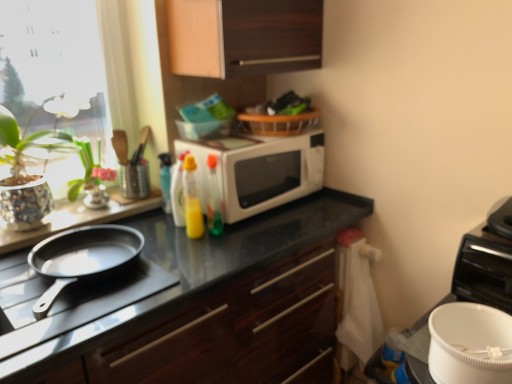
The height and width of the screenshot is (384, 512). What are the coordinates of `white glossy microwave at center` in the screenshot? It's located at (259, 170).

In order to face white glossy microwave at center, should I rotate leftwards or rightwards?

Rotate your view right by about 0.259°.

Measure the distance between point (509, 297) and camera.

The distance of point (509, 297) from camera is 1.20 meters.

You are a GUI agent. You are given a task and a screenshot of the screen. Output one action in this format:
    pyautogui.click(x=<x>, y=<y>)
    Task: Click on the translucent plastic spray bottle at upper center, marked as the fourth bottle in a right-to-left arrangement
    Image resolution: width=512 pixels, height=384 pixels.
    Given the screenshot: What is the action you would take?
    pyautogui.click(x=165, y=180)

At what (x,y) coordinates should I click in order to perform the action: click on translucent plastic bottle at center, which is counted as the 4th bottle, starting from the left. Please return your answer as a coordinate pair (x, y). This screenshot has height=384, width=512. Looking at the image, I should click on pyautogui.click(x=213, y=198).

Does white plastic bucket at lower right have a greater width compared to translucent plastic bottle at center, which is counted as the 4th bottle, starting from the left?

Yes.

Which of these two, white plastic bucket at lower right or translucent plastic bottle at center, which is counted as the 4th bottle, starting from the left, stands taller?

white plastic bucket at lower right is taller.

Is white plastic bucket at lower right smaller than translucent plastic bottle at center, which ranks as the 1th bottle in right-to-left order?

Actually, white plastic bucket at lower right might be larger than translucent plastic bottle at center, which ranks as the 1th bottle in right-to-left order.

Can you see white plastic bucket at lower right touching translucent plastic bottle at center, which is counted as the 4th bottle, starting from the left?

white plastic bucket at lower right and translucent plastic bottle at center, which is counted as the 4th bottle, starting from the left, are clearly separated.

Considering the relative sizes of white plastic bucket at lower right and glossy dark wood cabinet at center, acting as the 2th cabinetry starting from the top, in the image provided, is white plastic bucket at lower right shorter than glossy dark wood cabinet at center, acting as the 2th cabinetry starting from the top,?

Indeed, white plastic bucket at lower right has a lesser height compared to glossy dark wood cabinet at center, acting as the 2th cabinetry starting from the top.

Is white plastic bucket at lower right with glossy dark wood cabinet at center, acting as the 2th cabinetry starting from the top?

There is a gap between white plastic bucket at lower right and glossy dark wood cabinet at center, acting as the 2th cabinetry starting from the top.

Which object is positioned more to the left, white plastic bucket at lower right or glossy dark wood cabinet at center, acting as the 2th cabinetry starting from the top?

Positioned to the left is glossy dark wood cabinet at center, acting as the 2th cabinetry starting from the top.

Could you tell me if translucent plastic bottle at center, marked as the 3th bottle in a left-to-right arrangement, is turned towards white matte mixing bowl at lower right?

No, translucent plastic bottle at center, marked as the 3th bottle in a left-to-right arrangement, is not oriented towards white matte mixing bowl at lower right.

Between translucent plastic bottle at center, marked as the 3th bottle in a left-to-right arrangement, and white matte mixing bowl at lower right, which one appears on the left side from the viewer's perspective?

From the viewer's perspective, translucent plastic bottle at center, marked as the 3th bottle in a left-to-right arrangement, appears more on the left side.

Consider the image. Relative to white matte mixing bowl at lower right, is translucent plastic bottle at center, marked as the 3th bottle in a left-to-right arrangement, in front or behind?

translucent plastic bottle at center, marked as the 3th bottle in a left-to-right arrangement, is positioned farther from the viewer than white matte mixing bowl at lower right.

Is point (199, 204) closer to viewer compared to point (163, 191)?

Yes, it is.

Is translucent plastic bottle at center, marked as the 3th bottle in a left-to-right arrangement, wider than translucent plastic spray bottle at upper center, marked as the fourth bottle in a right-to-left arrangement?

Yes, translucent plastic bottle at center, marked as the 3th bottle in a left-to-right arrangement, is wider than translucent plastic spray bottle at upper center, marked as the fourth bottle in a right-to-left arrangement.

Between translucent plastic bottle at center, the second bottle positioned from the right, and translucent plastic spray bottle at upper center, marked as the fourth bottle in a right-to-left arrangement, which one is positioned behind?

translucent plastic spray bottle at upper center, marked as the fourth bottle in a right-to-left arrangement.

Does translucent plastic bottle at center, marked as the 3th bottle in a left-to-right arrangement, turn towards translucent plastic spray bottle at upper center, marked as the fourth bottle in a right-to-left arrangement?

No, translucent plastic bottle at center, marked as the 3th bottle in a left-to-right arrangement, does not turn towards translucent plastic spray bottle at upper center, marked as the fourth bottle in a right-to-left arrangement.

Is white matte mixing bowl at lower right aimed at black matte pan at left?

No.

At what (x,y) coordinates should I click in order to perform the action: click on gas stove behind the white matte mixing bowl at lower right. Please return your answer as a coordinate pair (x, y). The height and width of the screenshot is (384, 512). Looking at the image, I should click on (82, 283).

Looking at this image, from the image's perspective, who appears lower, white matte mixing bowl at lower right or black matte pan at left?

white matte mixing bowl at lower right is shown below in the image.

Considering the points (450, 361) and (68, 313), which point is in front, point (450, 361) or point (68, 313)?

The point (450, 361) is closer.

Image resolution: width=512 pixels, height=384 pixels. Identify the location of mixing bowl below the yellow translucent bottle at center, which is counted as the 2th bottle, starting from the left (from the image's perspective). (469, 344).

From the image's perspective, is white matte mixing bowl at lower right positioned above or below yellow translucent bottle at center, which is the 3th bottle from right to left?

Clearly, from the image's perspective, white matte mixing bowl at lower right is below yellow translucent bottle at center, which is the 3th bottle from right to left.

Is white matte mixing bowl at lower right positioned behind yellow translucent bottle at center, which is counted as the 2th bottle, starting from the left?

No, it is not.

Considering the points (496, 346) and (176, 221), which point is behind, point (496, 346) or point (176, 221)?

Positioned behind is point (176, 221).

From the image's perspective, is translucent plastic bottle at center, which is counted as the 4th bottle, starting from the left, positioned above or below translucent plastic spray bottle at upper center, the first bottle from the left?

translucent plastic bottle at center, which is counted as the 4th bottle, starting from the left, is below translucent plastic spray bottle at upper center, the first bottle from the left.

Is there a large distance between translucent plastic bottle at center, which ranks as the 1th bottle in right-to-left order, and translucent plastic spray bottle at upper center, the first bottle from the left?

No, translucent plastic bottle at center, which ranks as the 1th bottle in right-to-left order, is in close proximity to translucent plastic spray bottle at upper center, the first bottle from the left.

In terms of width, does translucent plastic bottle at center, which ranks as the 1th bottle in right-to-left order, look wider or thinner when compared to translucent plastic spray bottle at upper center, marked as the fourth bottle in a right-to-left arrangement?

In the image, translucent plastic bottle at center, which ranks as the 1th bottle in right-to-left order, appears to be wider than translucent plastic spray bottle at upper center, marked as the fourth bottle in a right-to-left arrangement.

Is translucent plastic bottle at center, which is counted as the 4th bottle, starting from the left, completely or partially outside of translucent plastic spray bottle at upper center, the first bottle from the left?

Yes, translucent plastic bottle at center, which is counted as the 4th bottle, starting from the left, is not within translucent plastic spray bottle at upper center, the first bottle from the left.

Where is `appliance that appears on the right of translucent plastic bottle at center, which is counted as the 4th bottle, starting from the left`? This screenshot has width=512, height=384. appliance that appears on the right of translucent plastic bottle at center, which is counted as the 4th bottle, starting from the left is located at coordinates (482, 267).

Identify the location of cabinetry in front of the white plastic bucket at lower right. The image size is (512, 384). (191, 304).

Estimate the real-world distances between objects in this image. Which object is closer to translucent plastic bottle at center, which ranks as the 1th bottle in right-to-left order, white matte mixing bowl at lower right or glossy dark wood cabinet at center, acting as the 2th cabinetry starting from the top?

Based on the image, glossy dark wood cabinet at center, acting as the 2th cabinetry starting from the top, appears to be nearer to translucent plastic bottle at center, which ranks as the 1th bottle in right-to-left order.

Considering their positions, is black matte pan at left positioned further to white glossy microwave at center than white matte mixing bowl at lower right?

white matte mixing bowl at lower right.

Based on their spatial positions, is matte black pan at left, which ranks as the 1th cabinetry in top-to-bottom order, or translucent plastic bottle at center, which is counted as the 4th bottle, starting from the left, closer to yellow translucent bottle at center, which is counted as the 2th bottle, starting from the left?

translucent plastic bottle at center, which is counted as the 4th bottle, starting from the left, lies closer to yellow translucent bottle at center, which is counted as the 2th bottle, starting from the left, than the other object.

When comparing their distances from translucent plastic bottle at center, which ranks as the 1th bottle in right-to-left order, does white matte mixing bowl at lower right or white plastic bucket at lower right seem further?

white matte mixing bowl at lower right.

Considering their positions, is translucent plastic bottle at center, marked as the 3th bottle in a left-to-right arrangement, positioned further to matte black pan at left, which appears as the second cabinetry when ordered from the bottom, than glossy dark wood cabinet at center, acting as the 2th cabinetry starting from the top?

glossy dark wood cabinet at center, acting as the 2th cabinetry starting from the top.

When comparing their distances from white plastic bucket at lower right, does translucent plastic bottle at center, the second bottle positioned from the right, or green glossy vase at left seem closer?

Based on the image, translucent plastic bottle at center, the second bottle positioned from the right, appears to be nearer to white plastic bucket at lower right.

From the image, which object appears to be nearer to white matte mixing bowl at lower right, matte black pan at left, which appears as the second cabinetry when ordered from the bottom, or green glossy vase at left?

The object closer to white matte mixing bowl at lower right is matte black pan at left, which appears as the second cabinetry when ordered from the bottom.

Looking at the image, which one is located closer to white matte mixing bowl at lower right, translucent plastic bottle at center, which ranks as the 1th bottle in right-to-left order, or yellow translucent bottle at center, which is counted as the 2th bottle, starting from the left?

The object closer to white matte mixing bowl at lower right is translucent plastic bottle at center, which ranks as the 1th bottle in right-to-left order.

The width and height of the screenshot is (512, 384). Find the location of `microwave oven located between translucent plastic spray bottle at upper center, the first bottle from the left, and white matte mixing bowl at lower right in the left-right direction`. microwave oven located between translucent plastic spray bottle at upper center, the first bottle from the left, and white matte mixing bowl at lower right in the left-right direction is located at coordinates (259, 170).

The height and width of the screenshot is (384, 512). In order to click on plant between glossy dark wood cabinet at center, the 1th cabinetry from the bottom, and translucent plastic spray bottle at upper center, marked as the fourth bottle in a right-to-left arrangement, from front to back in this screenshot , I will do `click(89, 170)`.

In order to click on cabinetry between yellow translucent bottle at center, which is counted as the 2th bottle, starting from the left, and white matte mixing bowl at lower right, in the horizontal direction in this screenshot , I will do `click(191, 304)`.

Where is `plant between white glossy microwave at center and glossy dark wood cabinet at center, acting as the 2th cabinetry starting from the top, vertically`? plant between white glossy microwave at center and glossy dark wood cabinet at center, acting as the 2th cabinetry starting from the top, vertically is located at coordinates (89, 170).